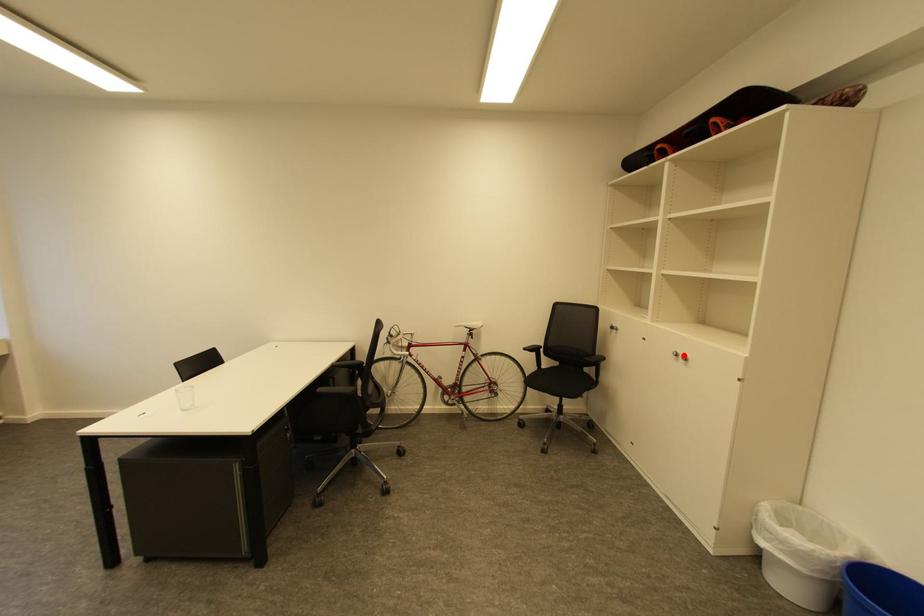
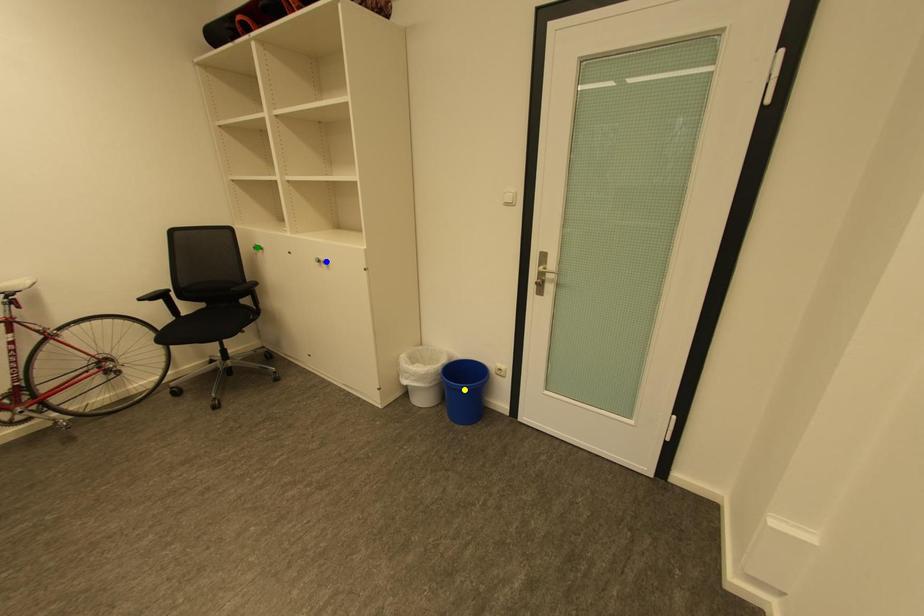
Question: I am providing you with two images of the same scene from different viewpoints. A red point is marked on the first image. You are given multiple points on the second image. Which point in image 2 represents the same 3d spot as the red point in image 1?

Choices:
 (A) blue point
 (B) yellow point
 (C) green point

Answer: (A)